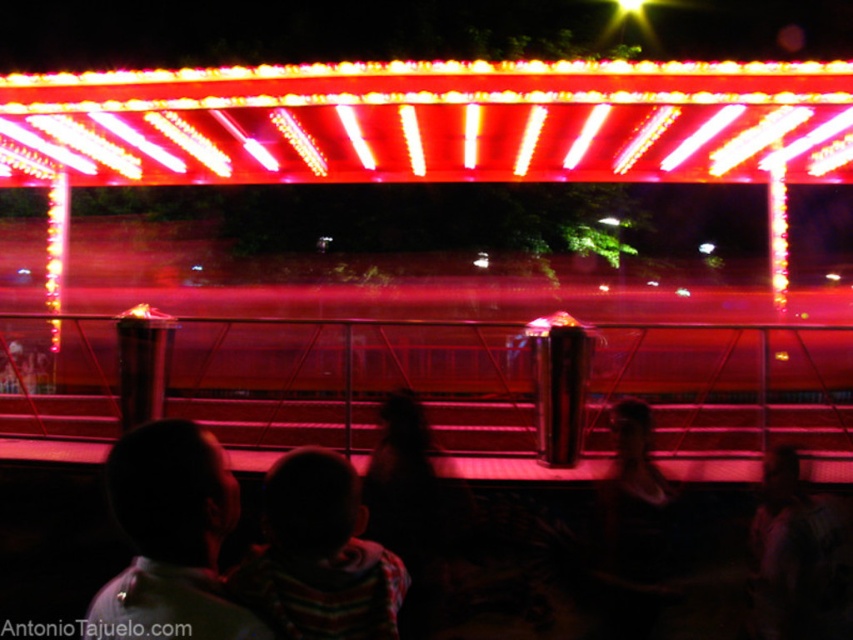
You are standing in the carnival scene and want to take a photo of the dark hair at lower left and striped sweater at center. Which object should you focus on first to ensure both are in the frame?

You should focus on the dark hair at lower left first because it is closer to the viewer than the striped sweater at center, so adjusting the camera to include both would require starting with the closer object.

You are a photographer trying to capture the bright red neon lights at upper center and the dark hair at lower left in the same frame. Based on their heights, which object should you focus on first to ensure both are in the frame?

The bright red neon lights at upper center is not as tall as dark hair at lower left, so you should focus on the dark hair at lower left first to ensure both are in the frame.